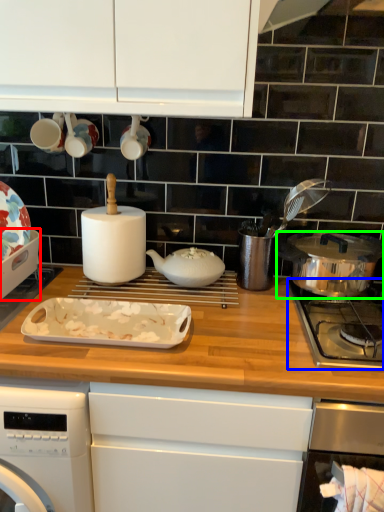
Question: Considering the real-world distances, which object is closest to kitchen appliance (highlighted by a red box)? gas stove (highlighted by a blue box) or kitchen appliance (highlighted by a green box).

Choices:
 (A) gas stove
 (B) kitchen appliance

Answer: (A)